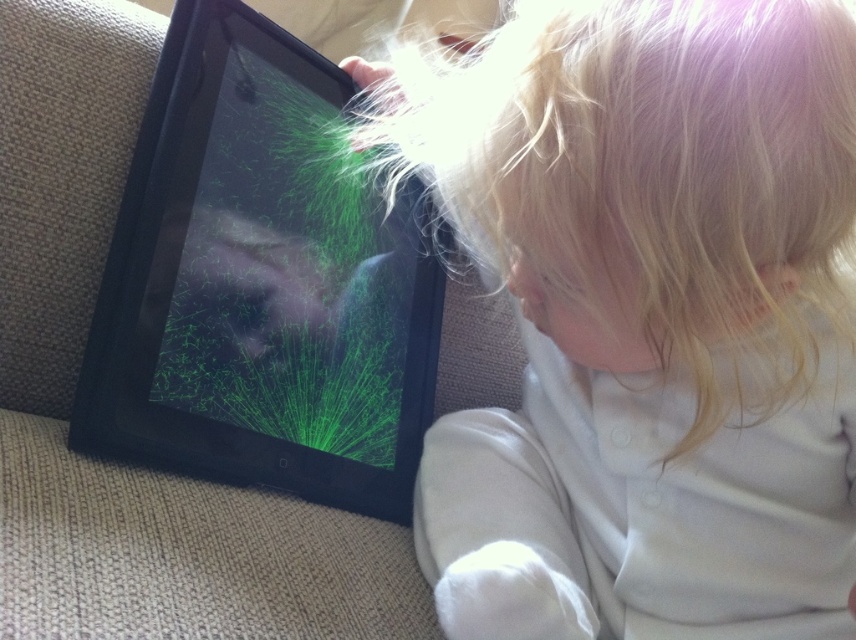
Locate an element on the screen. This screenshot has height=640, width=856. blonde hair at upper right is located at coordinates (646, 317).

Locate an element on the screen. blonde hair at upper right is located at coordinates (646, 317).

Find the location of a particular element. blonde hair at upper right is located at coordinates (646, 317).